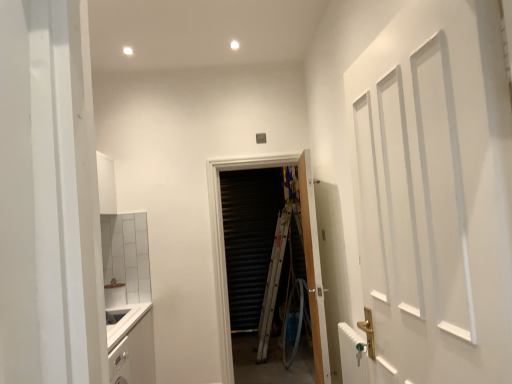
Locate an element on the screen. white matte cabinet at lower left is located at coordinates (133, 348).

This screenshot has height=384, width=512. Find the location of `white matte door at right, marked as the 3th door in a back-to-front arrangement`. white matte door at right, marked as the 3th door in a back-to-front arrangement is located at coordinates 436,193.

In terms of width, does white metallic radiator at lower right look wider or thinner when compared to white matte cabinet at lower left?

Considering their sizes, white metallic radiator at lower right looks slimmer than white matte cabinet at lower left.

Between white metallic radiator at lower right and white matte cabinet at lower left, which one has smaller size?

Smaller between the two is white metallic radiator at lower right.

Is white metallic radiator at lower right further to the viewer compared to white matte cabinet at lower left?

That is False.

Measure the distance from white metallic radiator at lower right to white matte door at right, marked as the 3th door in a back-to-front arrangement.

white metallic radiator at lower right and white matte door at right, marked as the 3th door in a back-to-front arrangement, are 61.58 centimeters apart.

From the image's perspective, which one is positioned higher, white metallic radiator at lower right or white matte door at right, the 1th door from the front?

white matte door at right, the 1th door from the front, is shown above in the image.

Is white metallic radiator at lower right positioned beyond the bounds of white matte door at right, marked as the 3th door in a back-to-front arrangement?

Yes, white metallic radiator at lower right is outside of white matte door at right, marked as the 3th door in a back-to-front arrangement.

From a real-world perspective, relative to white matte door at right, the 1th door from the front, is white metallic radiator at lower right vertically above or below?

white metallic radiator at lower right is below white matte door at right, the 1th door from the front.

The height and width of the screenshot is (384, 512). I want to click on door that is the 1st object to the left of the wooden door at center, acting as the second door starting from the back, starting at the anchor, so click(x=436, y=193).

Consider the image. Which object is thinner, wooden door at center, acting as the second door starting from the back, or white matte door at right, marked as the 3th door in a back-to-front arrangement?

With smaller width is wooden door at center, acting as the second door starting from the back.

In the image, is wooden door at center, the second door viewed from the front, positioned in front of or behind white matte door at right, the 1th door from the front?

Clearly, wooden door at center, the second door viewed from the front, is behind white matte door at right, the 1th door from the front.

Who is more distant, wooden door at center, the second door viewed from the front, or white metallic radiator at lower right?

wooden door at center, the second door viewed from the front, is further away from the camera.

Who is bigger, wooden door at center, the second door viewed from the front, or white metallic radiator at lower right?

Bigger between the two is wooden door at center, the second door viewed from the front.

Is white metallic radiator at lower right at the back of wooden door at center, acting as the second door starting from the back?

No, wooden door at center, acting as the second door starting from the back, is not facing away from white metallic radiator at lower right.

Is wooden door at center, the second door viewed from the front, taller or shorter than white metallic radiator at lower right?

wooden door at center, the second door viewed from the front, is taller than white metallic radiator at lower right.

From the white metallic radiator at lower right, count the 1st door to the left and point to it. Please provide its 2D coordinates.

[(313, 269)]

How many degrees apart are the facing directions of white metallic radiator at lower right and wooden door at center, acting as the second door starting from the back?

They differ by 5.18 degrees in their facing directions.

Which of these two, white metallic radiator at lower right or wooden door at center, acting as the second door starting from the back, is wider?

wooden door at center, acting as the second door starting from the back, is wider.

Is white metallic radiator at lower right positioned with its back to wooden door at center, the second door viewed from the front?

No, wooden door at center, the second door viewed from the front, is not at the back of white metallic radiator at lower right.

Does white matte cabinet at lower left have a lesser height compared to wooden door at center, acting as the second door starting from the back?

Yes, white matte cabinet at lower left is shorter than wooden door at center, acting as the second door starting from the back.

From the image's perspective, which is above, white matte cabinet at lower left or wooden door at center, the second door viewed from the front?

wooden door at center, the second door viewed from the front.

How many degrees apart are the facing directions of white matte cabinet at lower left and wooden door at center, acting as the second door starting from the back?

177 degrees.

This screenshot has height=384, width=512. What are the coordinates of `cabinetry in front of the wooden door at center, acting as the second door starting from the back` in the screenshot? It's located at (133, 348).

Are wooden door at center, marked as the first door in a back-to-front arrangement, and white matte cabinet at lower left beside each other?

wooden door at center, marked as the first door in a back-to-front arrangement, and white matte cabinet at lower left are not in contact.

Identify the location of the 1st door above when counting from the white matte cabinet at lower left (from the image's perspective). Image resolution: width=512 pixels, height=384 pixels. (304, 251).

From their relative heights in the image, would you say wooden door at center, marked as the first door in a back-to-front arrangement, is taller or shorter than white matte cabinet at lower left?

wooden door at center, marked as the first door in a back-to-front arrangement, is taller than white matte cabinet at lower left.

I want to click on cabinetry that appears below the white metallic radiator at lower right (from a real-world perspective), so click(x=133, y=348).

Where is `door that is the 3rd object above the white metallic radiator at lower right (from a real-world perspective)`? The height and width of the screenshot is (384, 512). door that is the 3rd object above the white metallic radiator at lower right (from a real-world perspective) is located at coordinates (436, 193).

From the picture: From the image, which object appears to be farther from wooden door at center, the third door in the front-to-back sequence, white metallic radiator at lower right or white matte cabinet at lower left?

white metallic radiator at lower right is further to wooden door at center, the third door in the front-to-back sequence.

Estimate the real-world distances between objects in this image. Which object is closer to white matte cabinet at lower left, white metallic radiator at lower right or wooden door at center, marked as the first door in a back-to-front arrangement?

wooden door at center, marked as the first door in a back-to-front arrangement.

Considering their positions, is white matte cabinet at lower left positioned further to wooden door at center, the third door in the front-to-back sequence, than white matte door at right, marked as the 3th door in a back-to-front arrangement?

Among the two, white matte door at right, marked as the 3th door in a back-to-front arrangement, is located further to wooden door at center, the third door in the front-to-back sequence.

Estimate the real-world distances between objects in this image. Which object is further from wooden door at center, acting as the second door starting from the back, wooden door at center, marked as the first door in a back-to-front arrangement, or white matte door at right, the 1th door from the front?

The object further to wooden door at center, acting as the second door starting from the back, is white matte door at right, the 1th door from the front.

Considering their positions, is wooden door at center, the third door in the front-to-back sequence, positioned further to wooden door at center, acting as the second door starting from the back, than white matte cabinet at lower left?

white matte cabinet at lower left is further to wooden door at center, acting as the second door starting from the back.

From the image, which object appears to be nearer to white matte door at right, marked as the 3th door in a back-to-front arrangement, white matte cabinet at lower left or wooden door at center, marked as the first door in a back-to-front arrangement?

Among the two, white matte cabinet at lower left is located nearer to white matte door at right, marked as the 3th door in a back-to-front arrangement.

Estimate the real-world distances between objects in this image. Which object is further from white matte door at right, marked as the 3th door in a back-to-front arrangement, white matte cabinet at lower left or white metallic radiator at lower right?

white matte cabinet at lower left.

Consider the image. Looking at the image, which one is located further to wooden door at center, the second door viewed from the front, white metallic radiator at lower right or white matte cabinet at lower left?

white matte cabinet at lower left is positioned further to the anchor wooden door at center, the second door viewed from the front.

The width and height of the screenshot is (512, 384). Identify the location of radiator between white matte door at right, the 1th door from the front, and wooden door at center, acting as the second door starting from the back, in the front-back direction. (352, 356).

The height and width of the screenshot is (384, 512). I want to click on door located between white metallic radiator at lower right and wooden door at center, the third door in the front-to-back sequence, in the depth direction, so click(x=313, y=269).

Identify the location of cabinetry between white matte door at right, marked as the 3th door in a back-to-front arrangement, and wooden door at center, the second door viewed from the front, along the z-axis. Image resolution: width=512 pixels, height=384 pixels. (133, 348).

Identify the location of radiator between white matte door at right, marked as the 3th door in a back-to-front arrangement, and white matte cabinet at lower left, along the z-axis. (x=352, y=356).